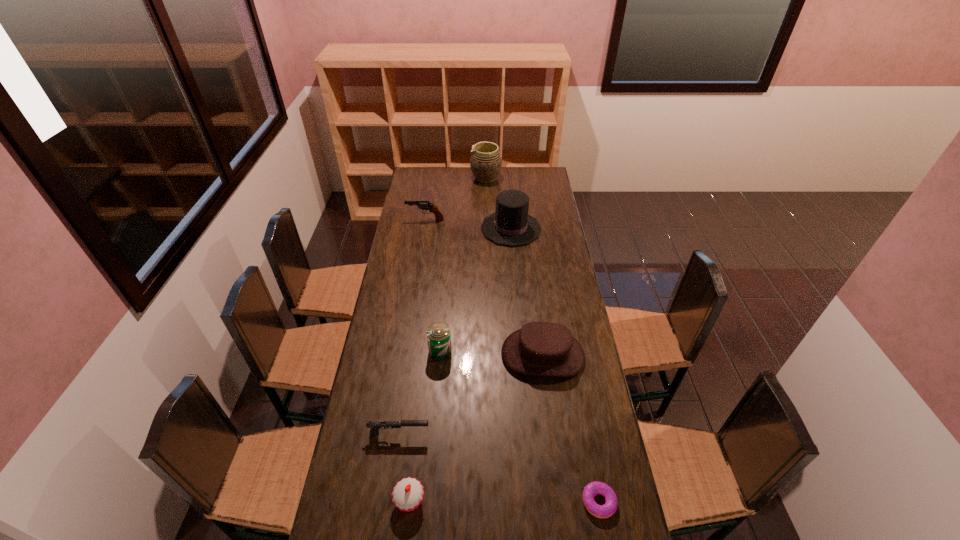
Where is `free space located on the front of the taller hat with the decoration`? This screenshot has height=540, width=960. free space located on the front of the taller hat with the decoration is located at coordinates (435, 228).

Image resolution: width=960 pixels, height=540 pixels. What are the coordinates of `vacant area located 0.190m on the front of the taller hat with the decoration` in the screenshot? It's located at (444, 228).

Identify the location of free space located 0.360m on the front of the taller hat with the decoration. The width and height of the screenshot is (960, 540). (409, 228).

Locate an element on the screen. This screenshot has height=540, width=960. vacant space located 0.230m on the right of the can is located at coordinates (513, 351).

Locate an element on the screen. This screenshot has width=960, height=540. free region located 0.360m on the front of the nearer hat is located at coordinates (560, 485).

You are a GUI agent. You are given a task and a screenshot of the screen. Output one action in this format:
    pyautogui.click(x=<x>, y=<y>)
    Task: Click on the free spot located on the right of the sixth tallest object
    
    Given the screenshot: What is the action you would take?
    pyautogui.click(x=543, y=501)

The width and height of the screenshot is (960, 540). Find the location of `vacant point located 0.230m at the muzzle end of the shorter gun`. vacant point located 0.230m at the muzzle end of the shorter gun is located at coordinates (501, 433).

Locate an element on the screen. vacant space located on the back of the doughnut is located at coordinates (584, 420).

This screenshot has height=540, width=960. In order to click on object that is positioned at the far edge in this screenshot , I will do `click(486, 161)`.

This screenshot has height=540, width=960. What are the coordinates of `cupcake that is positioned at the left edge` in the screenshot? It's located at (407, 495).